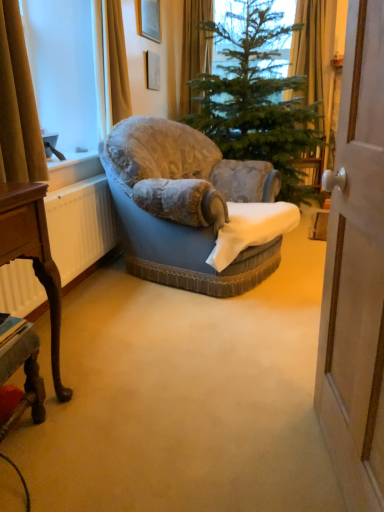
Question: Is the position of velvet blue armchair at center more distant than that of brown fabric curtain at left, the first curtain viewed from the front?

Choices:
 (A) no
 (B) yes

Answer: (B)

Question: Is brown fabric curtain at left, marked as the 2th curtain in a top-to-bottom arrangement, completely or partially inside velvet blue armchair at center?

Choices:
 (A) yes
 (B) no

Answer: (B)

Question: Is velvet blue armchair at center not inside brown fabric curtain at left, marked as the 2th curtain in a top-to-bottom arrangement?

Choices:
 (A) no
 (B) yes

Answer: (B)

Question: From the image's perspective, does velvet blue armchair at center appear lower than brown fabric curtain at left, arranged as the first curtain when viewed from the left?

Choices:
 (A) no
 (B) yes

Answer: (B)

Question: Is velvet blue armchair at center to the left of brown fabric curtain at left, the 1th curtain when ordered from bottom to top, from the viewer's perspective?

Choices:
 (A) yes
 (B) no

Answer: (B)

Question: Is matte gold picture frame at upper center taller or shorter than brown fabric curtain at left, the 2th curtain in the back-to-front sequence?

Choices:
 (A) short
 (B) tall

Answer: (A)

Question: From a real-world perspective, relative to brown fabric curtain at left, arranged as the 2th curtain when viewed from the right, is matte gold picture frame at upper center vertically above or below?

Choices:
 (A) below
 (B) above

Answer: (B)

Question: Based on their positions, is matte gold picture frame at upper center located to the left or right of brown fabric curtain at left, arranged as the 2th curtain when viewed from the right?

Choices:
 (A) left
 (B) right

Answer: (B)

Question: In terms of size, does matte gold picture frame at upper center appear bigger or smaller than brown fabric curtain at left, marked as the 2th curtain in a top-to-bottom arrangement?

Choices:
 (A) small
 (B) big

Answer: (A)

Question: From the image's perspective, is wooden desk at lower left, which is the first desk from bottom to top, located above or below velvet blue armchair at center?

Choices:
 (A) below
 (B) above

Answer: (A)

Question: In terms of size, does wooden desk at lower left, which is the second desk from top to bottom, appear bigger or smaller than velvet blue armchair at center?

Choices:
 (A) small
 (B) big

Answer: (A)

Question: Relative to velvet blue armchair at center, is wooden desk at lower left, which is the first desk from bottom to top, in front or behind?

Choices:
 (A) behind
 (B) front

Answer: (B)

Question: Considering the positions of wooden desk at lower left, which is the first desk from bottom to top, and velvet blue armchair at center in the image, is wooden desk at lower left, which is the first desk from bottom to top, taller or shorter than velvet blue armchair at center?

Choices:
 (A) short
 (B) tall

Answer: (A)

Question: Looking at their shapes, would you say wooden polished desk at lower left, acting as the 2th desk starting from the bottom, is wider or thinner than white matte radiator at left?

Choices:
 (A) thin
 (B) wide

Answer: (B)

Question: Is wooden polished desk at lower left, acting as the 2th desk starting from the bottom, in front of or behind white matte radiator at left in the image?

Choices:
 (A) front
 (B) behind

Answer: (A)